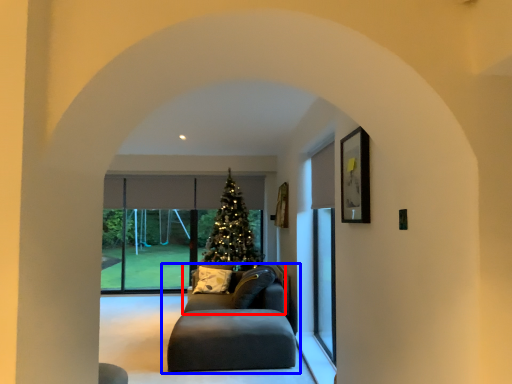
Question: Which of the following is the closest to the observer, couch (highlighted by a red box) or studio couch (highlighted by a blue box)?

Choices:
 (A) couch
 (B) studio couch

Answer: (B)